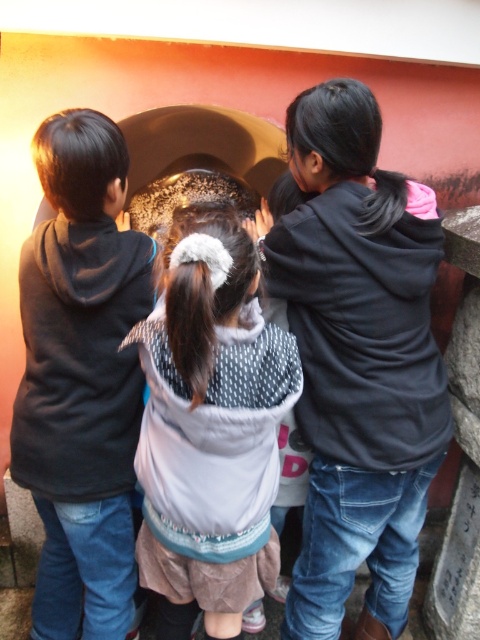
Question: Is black matte hoodie at upper right above white dotted sweater at center?

Choices:
 (A) yes
 (B) no

Answer: (A)

Question: Is black matte hoodie at upper right behind matte black hoodie at left?

Choices:
 (A) yes
 (B) no

Answer: (A)

Question: Which object is closer to the camera taking this photo?

Choices:
 (A) black matte hoodie at upper right
 (B) matte black hoodie at left

Answer: (B)

Question: Based on their relative distances, which object is nearer to the black matte hoodie at upper right?

Choices:
 (A) matte black hoodie at left
 (B) white dotted sweater at center

Answer: (B)

Question: Estimate the real-world distances between objects in this image. Which object is farther from the matte black hoodie at left?

Choices:
 (A) white dotted sweater at center
 (B) black matte hoodie at upper right

Answer: (B)

Question: Can you confirm if black matte hoodie at upper right is bigger than white dotted sweater at center?

Choices:
 (A) yes
 (B) no

Answer: (A)